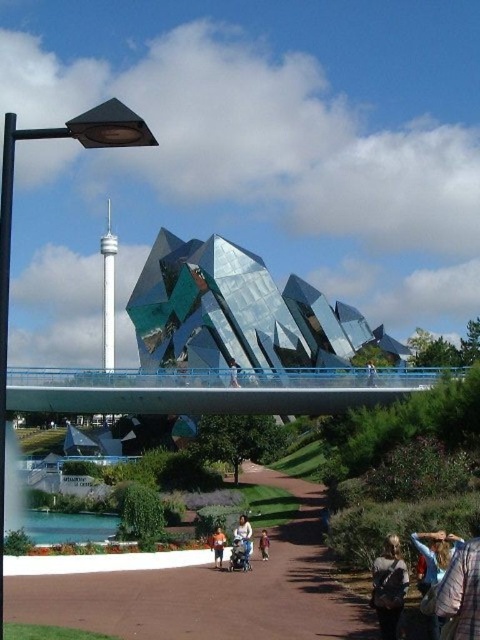
Which of these two, shiny glass sculpture at center or matte blue jacket at center, stands taller?

shiny glass sculpture at center is taller.

Does shiny glass sculpture at center have a lesser width compared to matte blue jacket at center?

In fact, shiny glass sculpture at center might be wider than matte blue jacket at center.

Which is behind, point (360, 346) or point (236, 380)?

Point (360, 346)

Locate an element on the screen. The width and height of the screenshot is (480, 640). shiny glass sculpture at center is located at coordinates (239, 314).

Locate an element on the screen. This screenshot has width=480, height=640. brown dirt path at lower center is located at coordinates (201, 588).

How distant is brown dirt path at lower center from matte black jacket at lower right?

brown dirt path at lower center is 24.58 feet away from matte black jacket at lower right.

Identify the location of brown dirt path at lower center. This screenshot has width=480, height=640. (201, 588).

Does shiny glass sculpture at center have a larger size compared to black metal lamp post at left?

Incorrect, shiny glass sculpture at center is not larger than black metal lamp post at left.

Which is above, shiny glass sculpture at center or black metal lamp post at left?

black metal lamp post at left is above.

Measure the distance between point (247, 321) and camera.

132.00 meters

Locate an element on the screen. Image resolution: width=480 pixels, height=640 pixels. shiny glass sculpture at center is located at coordinates (239, 314).